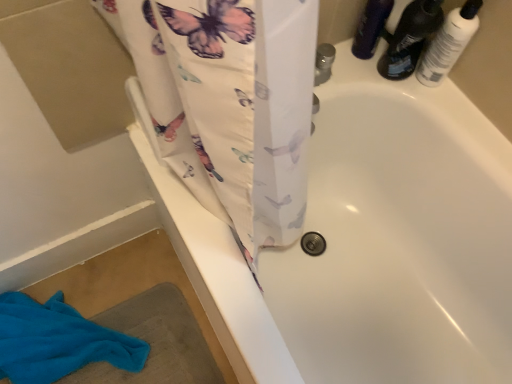
What do you see at coordinates (58, 341) in the screenshot?
I see `blue cotton towel at lower left` at bounding box center [58, 341].

Identify the location of white glossy bottle at upper right, which is counted as the second toiletry, starting from the left. Image resolution: width=512 pixels, height=384 pixels. (448, 43).

From a real-world perspective, is white glossy bottle at upper right, which is counted as the second toiletry, starting from the left, beneath translucent plastic bottles at upper right?

No.

Is white glossy bottle at upper right, which is counted as the second toiletry, starting from the left, placed right next to translucent plastic bottles at upper right?

Yes, white glossy bottle at upper right, which is counted as the second toiletry, starting from the left, is in contact with translucent plastic bottles at upper right.

How much distance is there between white glossy bottle at upper right, which is counted as the second toiletry, starting from the left, and translucent plastic bottles at upper right?

A distance of 1.74 inches exists between white glossy bottle at upper right, which is counted as the second toiletry, starting from the left, and translucent plastic bottles at upper right.

Looking at this image, which is closer, (439, 57) or (413, 23)?

Clearly, point (439, 57) is more distant from the camera than point (413, 23).

Locate an element on the screen. Image resolution: width=512 pixels, height=384 pixels. toiletry that is the 2nd one when counting upward from the blue cotton towel at lower left (from the image's perspective) is located at coordinates (371, 27).

From a real-world perspective, does matte black bottle at upper right, marked as the second toiletry in a right-to-left arrangement, sit lower than blue cotton towel at lower left?

No, from a real-world perspective, matte black bottle at upper right, marked as the second toiletry in a right-to-left arrangement, is not beneath blue cotton towel at lower left.

From the image's perspective, relative to blue cotton towel at lower left, is matte black bottle at upper right, the first toiletry from the left, above or below?

Based on their image positions, matte black bottle at upper right, the first toiletry from the left, is located above blue cotton towel at lower left.

Is matte black bottle at upper right, the first toiletry from the left, placed right next to blue cotton towel at lower left?

matte black bottle at upper right, the first toiletry from the left, and blue cotton towel at lower left are not in contact.

In the scene shown: Is white glossy bottle at upper right, which is counted as the second toiletry, starting from the left, spatially inside matte black bottle at upper right, marked as the second toiletry in a right-to-left arrangement, or outside of it?

white glossy bottle at upper right, which is counted as the second toiletry, starting from the left, is spatially situated outside matte black bottle at upper right, marked as the second toiletry in a right-to-left arrangement.

From the image's perspective, is white glossy bottle at upper right, which is counted as the second toiletry, starting from the left, above matte black bottle at upper right, marked as the second toiletry in a right-to-left arrangement?

No, from the image's perspective, white glossy bottle at upper right, which is counted as the second toiletry, starting from the left, is not above matte black bottle at upper right, marked as the second toiletry in a right-to-left arrangement.

Which is further, [430,58] or [369,51]?

Point [369,51]

Is translucent plastic bottles at upper right taller or shorter than matte black bottle at upper right, marked as the second toiletry in a right-to-left arrangement?

Considering their sizes, translucent plastic bottles at upper right has more height than matte black bottle at upper right, marked as the second toiletry in a right-to-left arrangement.

Do you think translucent plastic bottles at upper right is within matte black bottle at upper right, marked as the second toiletry in a right-to-left arrangement, or outside of it?

translucent plastic bottles at upper right cannot be found inside matte black bottle at upper right, marked as the second toiletry in a right-to-left arrangement.

Is translucent plastic bottles at upper right facing away from matte black bottle at upper right, the first toiletry from the left?

No, translucent plastic bottles at upper right is not facing away from matte black bottle at upper right, the first toiletry from the left.

Locate an element on the screen. The height and width of the screenshot is (384, 512). beach towel lying behind the matte black bottle at upper right, the first toiletry from the left is located at coordinates (58, 341).

Could you measure the distance between blue cotton towel at lower left and matte black bottle at upper right, marked as the second toiletry in a right-to-left arrangement?

blue cotton towel at lower left is 3.32 feet from matte black bottle at upper right, marked as the second toiletry in a right-to-left arrangement.

Can you tell me how much blue cotton towel at lower left and matte black bottle at upper right, the first toiletry from the left, differ in facing direction?

The facing directions of blue cotton towel at lower left and matte black bottle at upper right, the first toiletry from the left, are 84.2 degrees apart.

Is blue cotton towel at lower left not near matte black bottle at upper right, marked as the second toiletry in a right-to-left arrangement?

That's right, there is a large distance between blue cotton towel at lower left and matte black bottle at upper right, marked as the second toiletry in a right-to-left arrangement.

Which of these two, matte black bottle at upper right, marked as the second toiletry in a right-to-left arrangement, or white glossy bottle at upper right, positioned as the first toiletry in right-to-left order, is thinner?

Thinner between the two is matte black bottle at upper right, marked as the second toiletry in a right-to-left arrangement.

Based on the photo, is matte black bottle at upper right, the first toiletry from the left, closer to the viewer compared to white glossy bottle at upper right, positioned as the first toiletry in right-to-left order?

No, matte black bottle at upper right, the first toiletry from the left, is behind white glossy bottle at upper right, positioned as the first toiletry in right-to-left order.

From the image's perspective, is translucent plastic bottles at upper right located above blue cotton towel at lower left?

Yes, from the image's perspective, translucent plastic bottles at upper right is over blue cotton towel at lower left.

Between point (429, 22) and point (110, 338), which one is positioned behind?

The point (110, 338) is farther from the camera.

Are translucent plastic bottles at upper right and blue cotton towel at lower left located far from each other?

Yes, translucent plastic bottles at upper right and blue cotton towel at lower left are located far from each other.

Is translucent plastic bottles at upper right positioned beyond the bounds of blue cotton towel at lower left?

Yes, translucent plastic bottles at upper right is outside of blue cotton towel at lower left.

The image size is (512, 384). In order to click on footwear on the left of white glossy bottle at upper right, which is counted as the second toiletry, starting from the left in this screenshot , I will do `click(409, 38)`.

Identify the location of toiletry that is the 2nd object located above the blue cotton towel at lower left (from the image's perspective). (371, 27).

Based on their spatial positions, is blue cotton towel at lower left or white glossy bottle at upper right, which is counted as the second toiletry, starting from the left, closer to matte black bottle at upper right, the first toiletry from the left?

Among the two, white glossy bottle at upper right, which is counted as the second toiletry, starting from the left, is located nearer to matte black bottle at upper right, the first toiletry from the left.

Looking at the image, which one is located closer to matte black bottle at upper right, marked as the second toiletry in a right-to-left arrangement, translucent plastic bottles at upper right or white glossy bottle at upper right, positioned as the first toiletry in right-to-left order?

Based on the image, translucent plastic bottles at upper right appears to be nearer to matte black bottle at upper right, marked as the second toiletry in a right-to-left arrangement.

Estimate the real-world distances between objects in this image. Which object is closer to matte black bottle at upper right, marked as the second toiletry in a right-to-left arrangement, blue cotton towel at lower left or translucent plastic bottles at upper right?

translucent plastic bottles at upper right is closer to matte black bottle at upper right, marked as the second toiletry in a right-to-left arrangement.

Estimate the real-world distances between objects in this image. Which object is closer to translucent plastic bottles at upper right, matte black bottle at upper right, marked as the second toiletry in a right-to-left arrangement, or white glossy bottle at upper right, which is counted as the second toiletry, starting from the left?

white glossy bottle at upper right, which is counted as the second toiletry, starting from the left.

From the image, which object appears to be farther from blue cotton towel at lower left, matte black bottle at upper right, marked as the second toiletry in a right-to-left arrangement, or translucent plastic bottles at upper right?

translucent plastic bottles at upper right is further to blue cotton towel at lower left.

When comparing their distances from white glossy bottle at upper right, which is counted as the second toiletry, starting from the left, does translucent plastic bottles at upper right or matte black bottle at upper right, the first toiletry from the left, seem closer?

translucent plastic bottles at upper right is closer to white glossy bottle at upper right, which is counted as the second toiletry, starting from the left.

In the scene shown: Considering their positions, is blue cotton towel at lower left positioned further to white glossy bottle at upper right, positioned as the first toiletry in right-to-left order, than translucent plastic bottles at upper right?

blue cotton towel at lower left is positioned further to the anchor white glossy bottle at upper right, positioned as the first toiletry in right-to-left order.

Estimate the real-world distances between objects in this image. Which object is further from blue cotton towel at lower left, translucent plastic bottles at upper right or white glossy bottle at upper right, which is counted as the second toiletry, starting from the left?

→ Based on the image, white glossy bottle at upper right, which is counted as the second toiletry, starting from the left, appears to be further to blue cotton towel at lower left.

You are a GUI agent. You are given a task and a screenshot of the screen. Output one action in this format:
    pyautogui.click(x=<x>, y=<y>)
    Task: Click on the footwear located between blue cotton towel at lower left and white glossy bottle at upper right, positioned as the first toiletry in right-to-left order, in the left-right direction
    
    Given the screenshot: What is the action you would take?
    pyautogui.click(x=409, y=38)

Locate an element on the screen. This screenshot has height=384, width=512. toiletry located between blue cotton towel at lower left and translucent plastic bottles at upper right in the left-right direction is located at coordinates (371, 27).

You are a GUI agent. You are given a task and a screenshot of the screen. Output one action in this format:
    pyautogui.click(x=<x>, y=<y>)
    Task: Click on the footwear between matte black bottle at upper right, the first toiletry from the left, and white glossy bottle at upper right, positioned as the first toiletry in right-to-left order, from left to right
    
    Given the screenshot: What is the action you would take?
    pyautogui.click(x=409, y=38)

This screenshot has width=512, height=384. I want to click on toiletry between blue cotton towel at lower left and white glossy bottle at upper right, which is counted as the second toiletry, starting from the left, from left to right, so click(x=371, y=27).